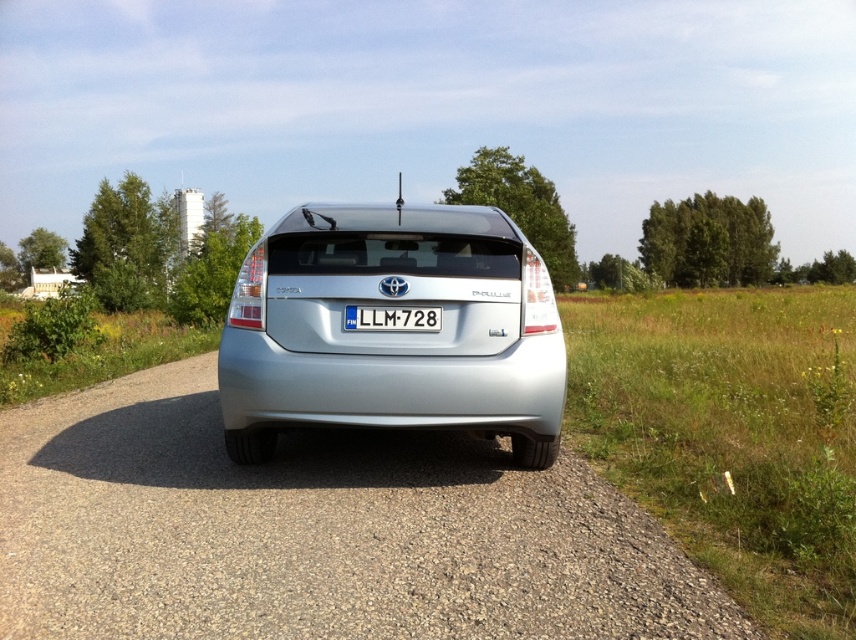
You are a photographer aiming to capture the entire satin silver car at center and the white plastic license plate at center in one frame. Since the car is much taller than the license plate, how should you adjust your camera angle to ensure both are fully visible?

Since the satin silver car at center is much taller than the white plastic license plate at center, you should lower your camera angle to include more of the car while still capturing the license plate at the bottom of the frame.

You are standing at the camera position and want to place a 3.5 meter long banner between the satin silver car at center and yourself. Can you fit the banner without it overlapping either the car or your position?

The distance between the satin silver car at center and the camera is 4.01 meters. Since the banner is 3.5 meters long, which is shorter than the distance between them, you can place the banner between the two without overlapping either the car or your position.